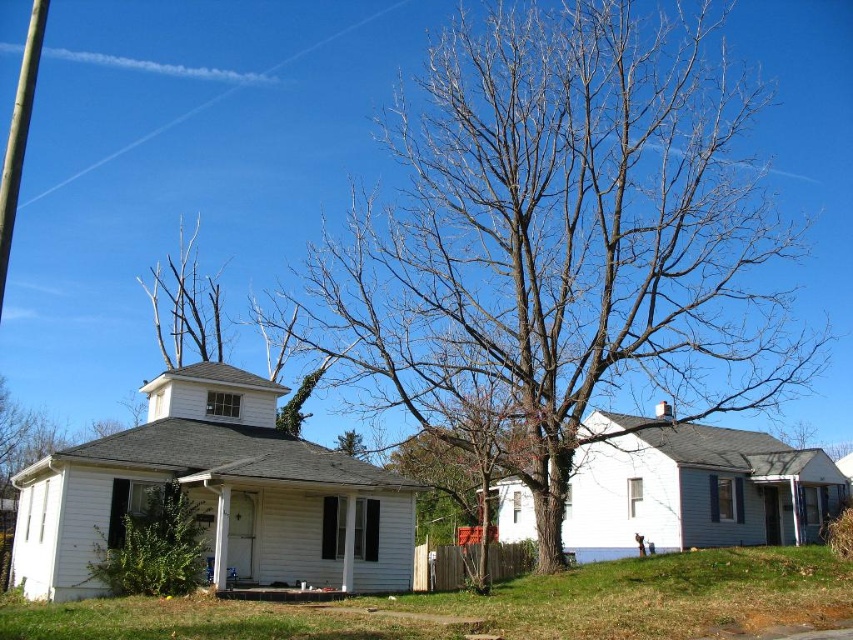
You are standing at the origin point in the image. Which direction should you move to reach the white wood house at center?

The white wood house at center is located at point 0.773 on the x and 0.254 on the y. Since you are at the origin, you should move towards the right and slightly downward to reach it.